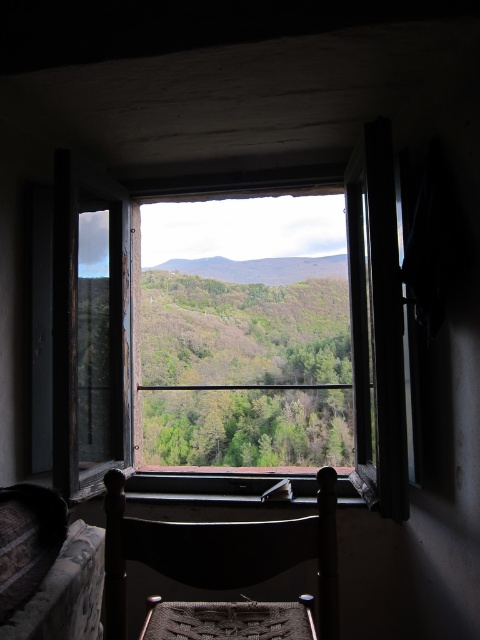
Is point (142, 429) positioned behind point (208, 276)?

No.

The image size is (480, 640). Describe the element at coordinates (230, 337) in the screenshot. I see `wooden window at center` at that location.

This screenshot has width=480, height=640. What are the coordinates of `wooden window at center` in the screenshot? It's located at (230, 337).

Who is positioned more to the right, dark wood chair at center or green leafy mountain at center?

green leafy mountain at center is more to the right.

Is dark wood chair at center below green leafy mountain at center?

Indeed, dark wood chair at center is positioned under green leafy mountain at center.

Is point (107, 492) positioned behind point (256, 260)?

No, (107, 492) is closer to viewer.

You are a GUI agent. You are given a task and a screenshot of the screen. Output one action in this format:
    pyautogui.click(x=<x>, y=<y>)
    Task: Click on the dark wood chair at center
    The width and height of the screenshot is (480, 640).
    Given the screenshot: What is the action you would take?
    pyautogui.click(x=219, y=552)

Which is behind, point (259, 241) or point (245, 618)?

The point (259, 241) is behind.

Does wooden window at center have a lesser height compared to dark wood chair at center?

In fact, wooden window at center may be taller than dark wood chair at center.

Does point (292, 387) come closer to viewer compared to point (267, 614)?

No, it is not.

This screenshot has height=640, width=480. Identify the location of wooden window at center. (230, 337).